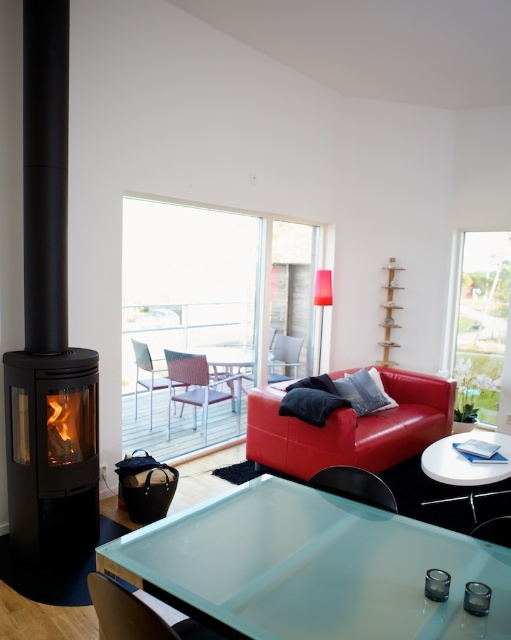
Can you confirm if matte gray armchair at center is wider than plastic/mesh armchair at center?

No.

Identify the location of matte gray armchair at center. The width and height of the screenshot is (511, 640). (284, 356).

Which is above, transparent glass table at center or matte leather couch at center?

transparent glass table at center is above.

Who is more forward, (x=222, y=500) or (x=315, y=458)?

Point (x=222, y=500) is in front.

What are the coordinates of `transparent glass table at center` in the screenshot? It's located at (311, 566).

Measure the distance from metallic purple armchair at center to matte gray armchair at center.

metallic purple armchair at center is 23.43 inches away from matte gray armchair at center.

Is point (203, 396) farther from viewer compared to point (283, 349)?

No, it is not.

I want to click on metallic purple armchair at center, so click(198, 387).